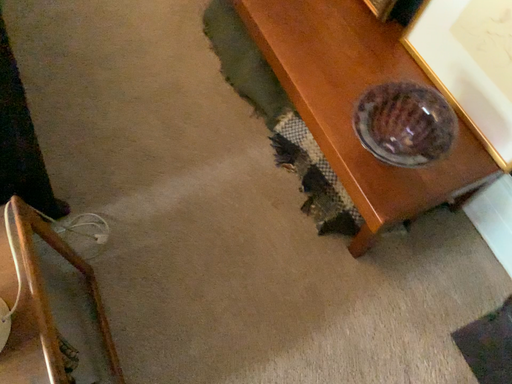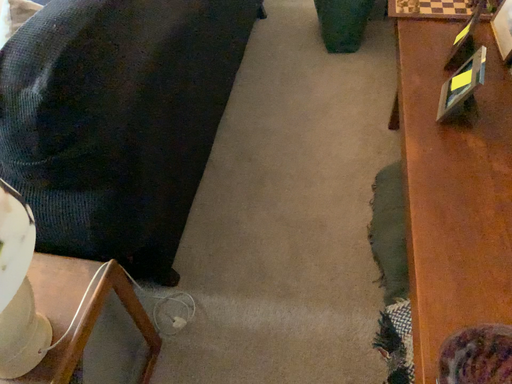
Question: How did the camera likely rotate when shooting the video?

Choices:
 (A) rotated downward
 (B) rotated upward

Answer: (B)